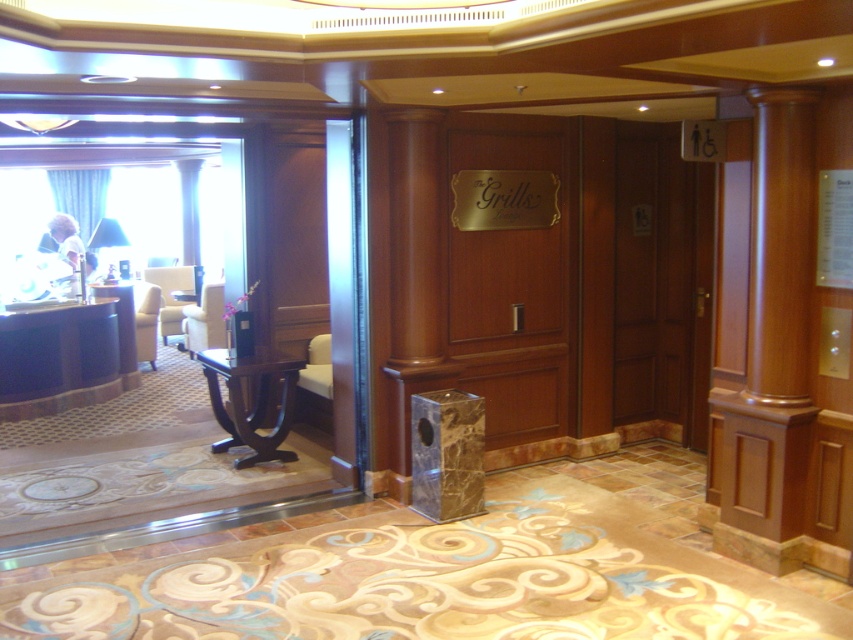
Question: Observing the image, what is the correct spatial positioning of wooden elevator at center in reference to wooden column at right?

Choices:
 (A) above
 (B) below

Answer: (A)

Question: Which point is closer to the camera?

Choices:
 (A) wooden elevator at center
 (B) wooden column at right

Answer: (B)

Question: Is wooden elevator at center bigger than wooden column at right?

Choices:
 (A) yes
 (B) no

Answer: (A)

Question: Which object appears farthest from the camera in this image?

Choices:
 (A) wooden column at right
 (B) wooden elevator at center

Answer: (B)

Question: Observing the image, what is the correct spatial positioning of wooden elevator at center in reference to wooden column at right?

Choices:
 (A) left
 (B) right

Answer: (A)